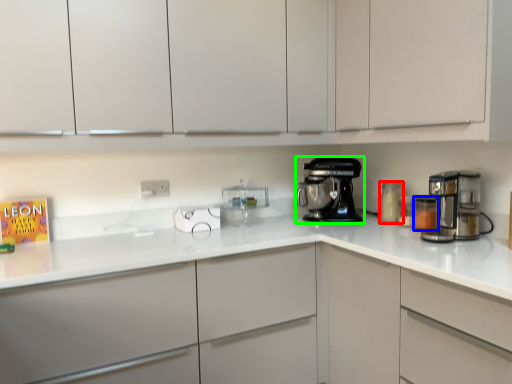
Question: Considering the real-world distances, which object is closest to kitchen appliance (highlighted by a red box)? kitchen appliance (highlighted by a blue box) or home appliance (highlighted by a green box).

Choices:
 (A) kitchen appliance
 (B) home appliance

Answer: (A)